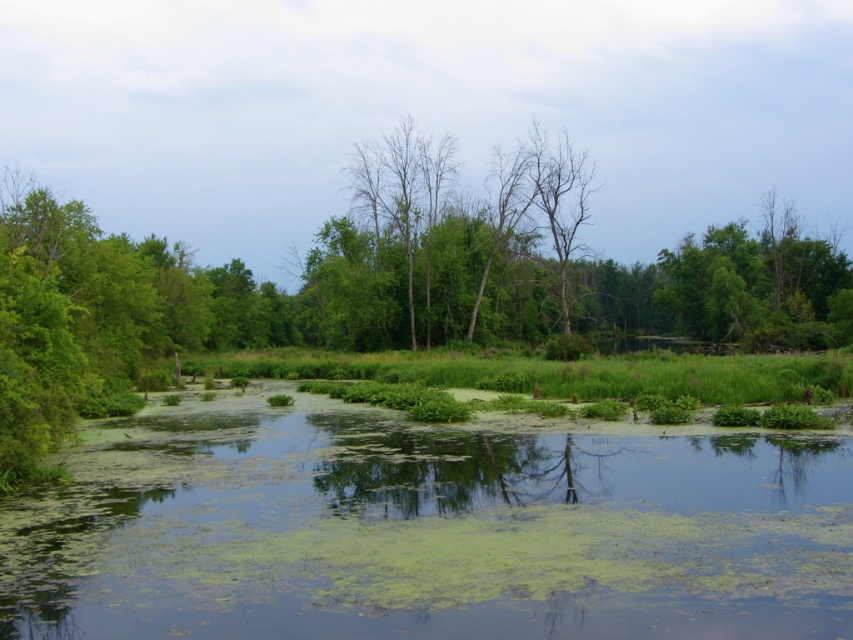
You are standing at the edge of the pond and see the point marked at coordinates (424, 529). What does this point represent in the scene?

The point at (424, 529) represents green algae covered water at center.